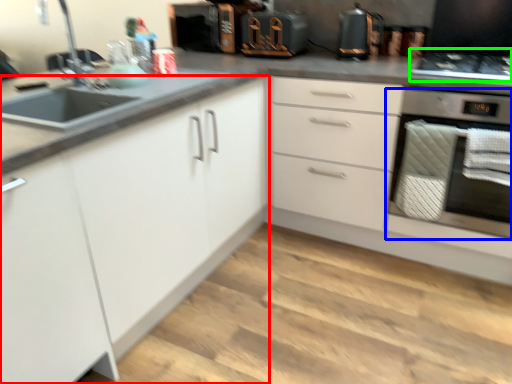
Question: Which object is the closest to the cabinetry (highlighted by a red box)? Choose among these: home appliance (highlighted by a blue box) or gas stove (highlighted by a green box).

Choices:
 (A) home appliance
 (B) gas stove

Answer: (A)